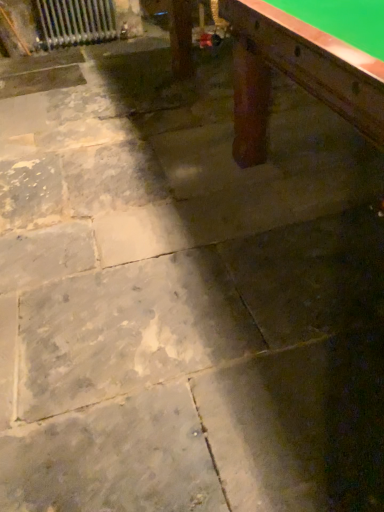
In order to face metallic radiator at upper left, should I rotate leftwards or rightwards?

A 15.055 degree turn to the left will do.

Locate an element on the screen. The height and width of the screenshot is (512, 384). metallic radiator at upper left is located at coordinates (76, 21).

Image resolution: width=384 pixels, height=512 pixels. What do you see at coordinates (76, 21) in the screenshot? I see `metallic radiator at upper left` at bounding box center [76, 21].

Image resolution: width=384 pixels, height=512 pixels. I want to click on metallic radiator at upper left, so click(76, 21).